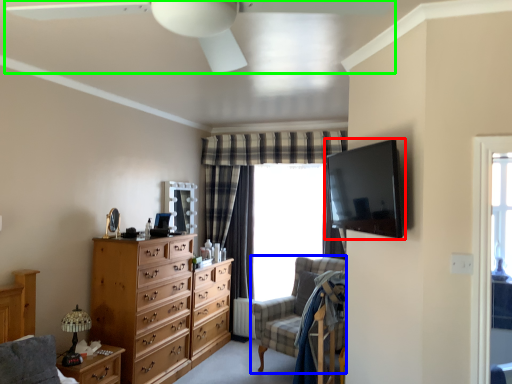
Question: Which object is positioned farthest from television (highlighted by a red box)? Select from swivel chair (highlighted by a blue box) and ceiling fan (highlighted by a green box).

Choices:
 (A) swivel chair
 (B) ceiling fan

Answer: (A)